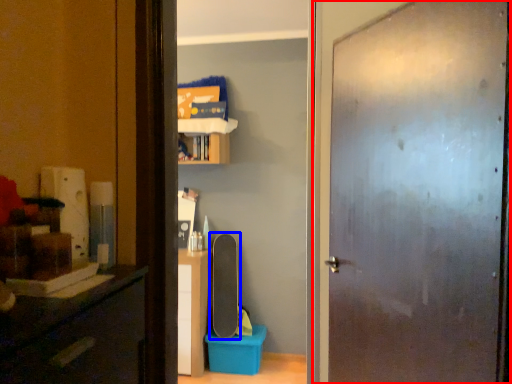
Question: Among these objects, which one is farthest to the camera, door (highlighted by a red box) or skateboard (highlighted by a blue box)?

Choices:
 (A) door
 (B) skateboard

Answer: (B)